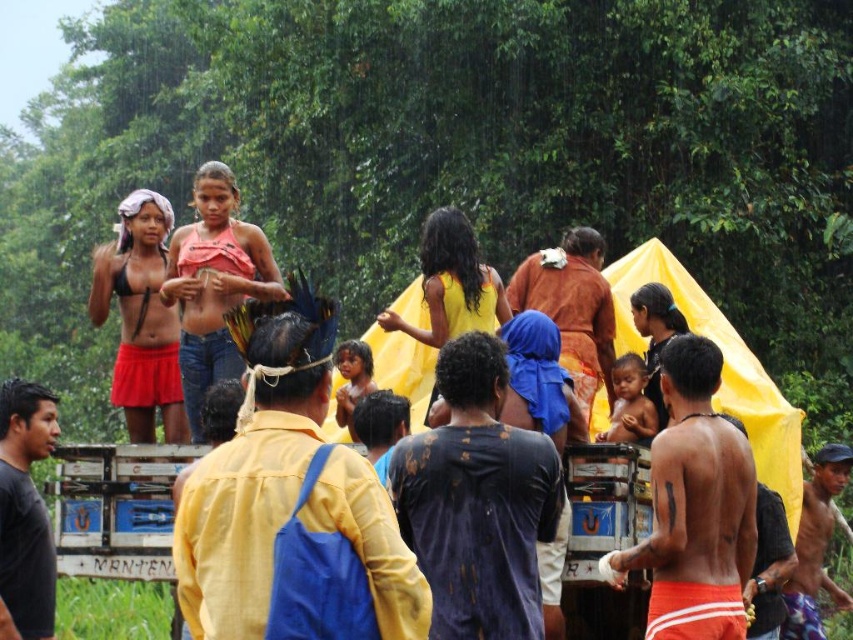
You are a photographer trying to capture a closeup of the shiny metallic bracelet at lower right and the smooth skin baby at center. Since you can only focus on one subject at a time, which one is easier to focus on given their positions?

The shiny metallic bracelet at lower right is positioned on the right side of smooth skin baby at center, so it is easier to focus on the shiny metallic bracelet at lower right without adjusting the camera angle too much.

In the scene described, there are a brown woven cloth at center and a smooth skin baby at center. Which object is taller?

The brown woven cloth at center is much taller than the smooth skin baby at center.

You are standing in the scene and notice the brown woven cloth at center. Based on its position, can you determine if it is placed closer to the front or the back of the group?

The brown woven cloth at center is located at point [572,307], which places it closer to the back of the group since it is positioned higher up in the image.